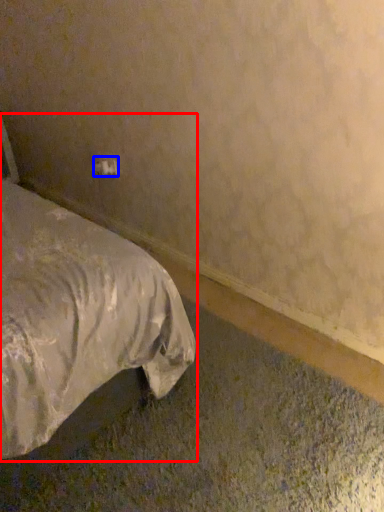
Question: Which object is further to the camera taking this photo, bed (highlighted by a red box) or electric outlet (highlighted by a blue box)?

Choices:
 (A) bed
 (B) electric outlet

Answer: (B)